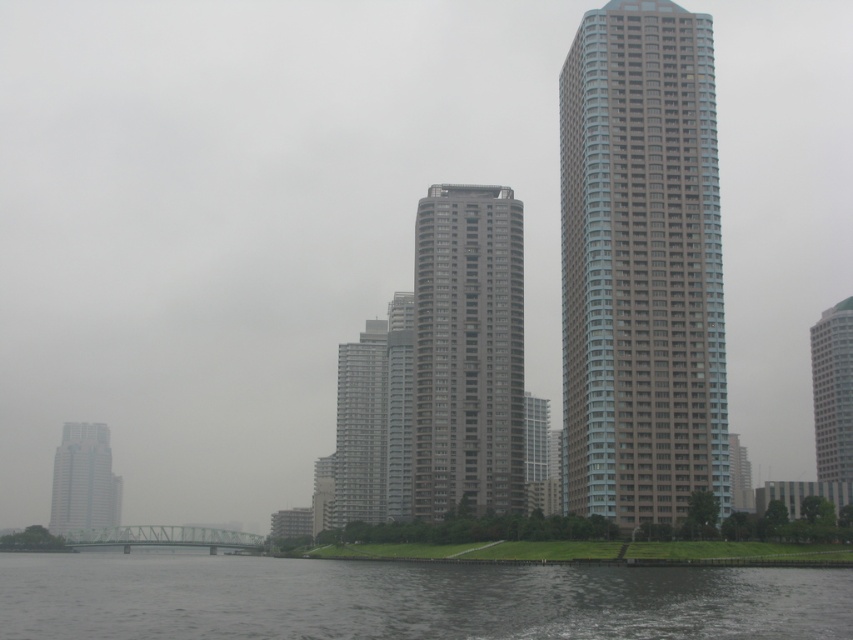
Question: Can you confirm if light gray concrete building at center is positioned below gray glass building at center?

Choices:
 (A) yes
 (B) no

Answer: (B)

Question: Does light gray concrete building at center have a greater width compared to gray concrete building at center?

Choices:
 (A) yes
 (B) no

Answer: (A)

Question: Can you confirm if light gray concrete building at center is wider than dark gray water at lower center?

Choices:
 (A) yes
 (B) no

Answer: (B)

Question: Which point appears farthest from the camera in this image?

Choices:
 (A) (83, 454)
 (B) (462, 426)
 (C) (354, 451)

Answer: (A)

Question: Which object is closer to the camera taking this photo?

Choices:
 (A) dark gray water at lower center
 (B) gray concrete building at left

Answer: (A)

Question: Which is nearer to the light gray concrete building at center?

Choices:
 (A) gray concrete building at left
 (B) white glossy building at right

Answer: (B)